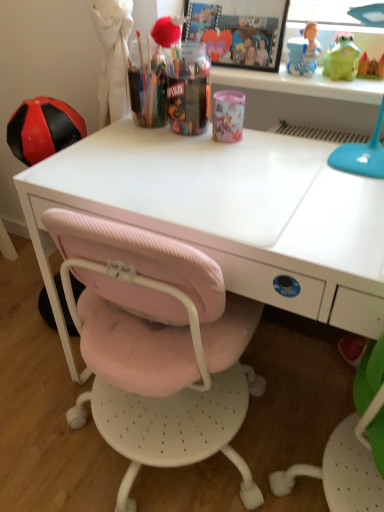
Locate an element on the screen. This screenshot has height=512, width=384. blank space above white matte desk at center (from a real-world perspective) is located at coordinates (238, 175).